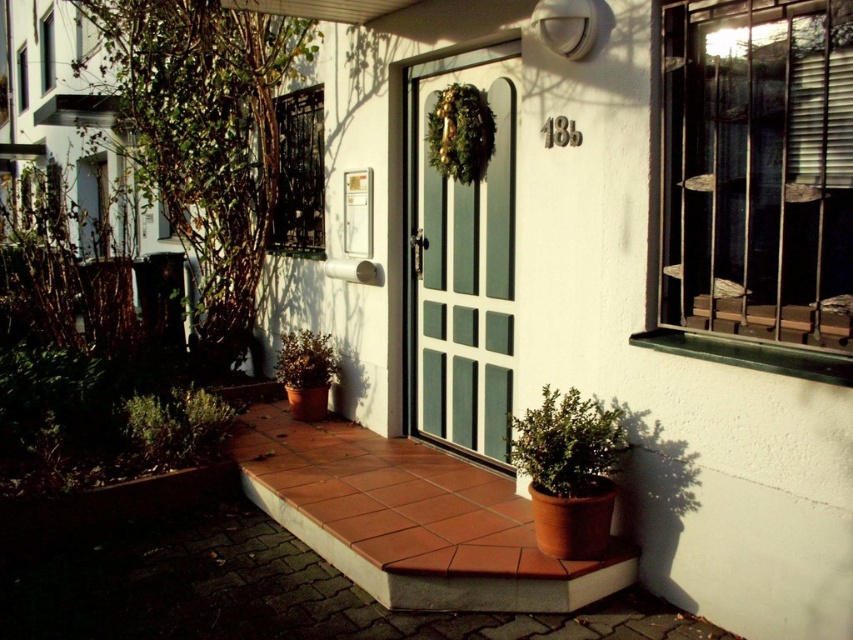
Is metallic bars at right wider than green matte plant at lower left?

No, metallic bars at right is not wider than green matte plant at lower left.

Who is taller, metallic bars at right or green matte plant at lower left?

With more height is metallic bars at right.

Who is more forward, (834, 358) or (326, 336)?

Point (834, 358) is in front.

Identify the location of metallic bars at right. The width and height of the screenshot is (853, 640). (757, 186).

Is green leafy plant at lower left thinner than green matte wreath at center?

In fact, green leafy plant at lower left might be wider than green matte wreath at center.

Between point (154, 442) and point (474, 173), which one is positioned behind?

The point (154, 442) is behind.

Does point (231, 417) come in front of point (463, 122)?

No, (231, 417) is behind (463, 122).

The width and height of the screenshot is (853, 640). I want to click on green leafy plant at lower left, so click(173, 428).

Is green matte wreath at center thinner than white painted wooden window at upper left?

Yes.

This screenshot has width=853, height=640. What do you see at coordinates (460, 132) in the screenshot?
I see `green matte wreath at center` at bounding box center [460, 132].

Where is `green matte wreath at center`? green matte wreath at center is located at coordinates (460, 132).

Locate an element on the screen. The height and width of the screenshot is (640, 853). green matte wreath at center is located at coordinates (460, 132).